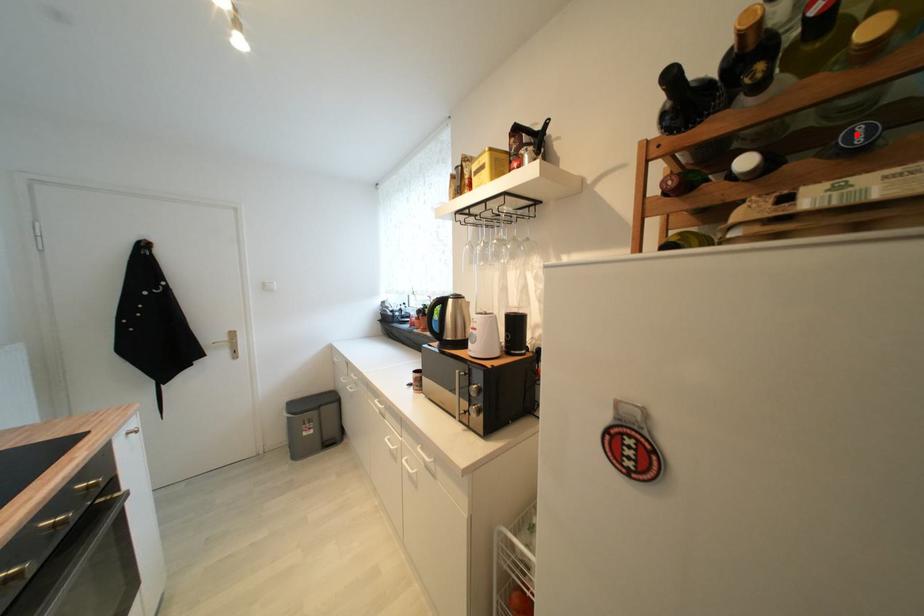
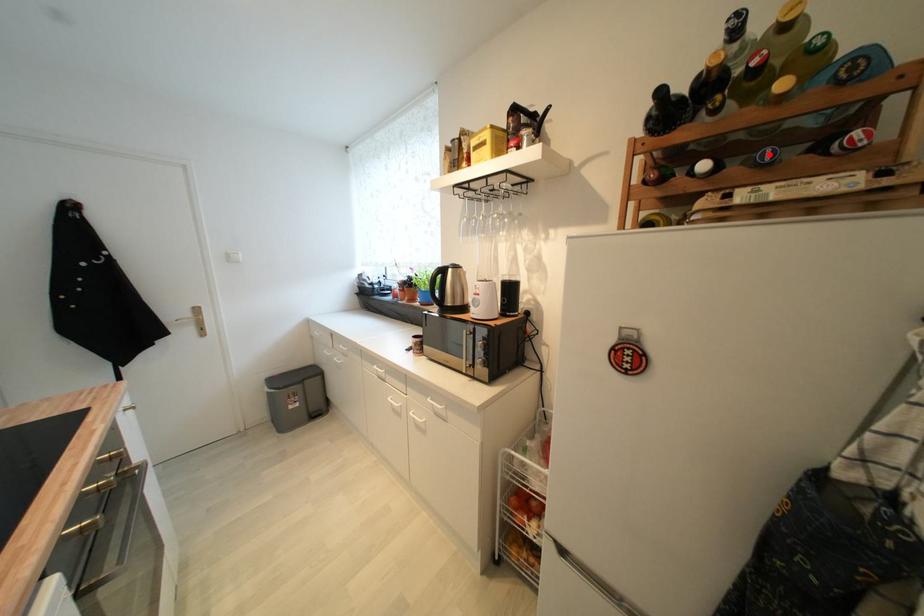
I am providing you with two images of the same scene from different viewpoints. A red point is marked on the first image and another point is marked on the second image. Is the red point in image1 aligned with the point shown in image2?

Yes